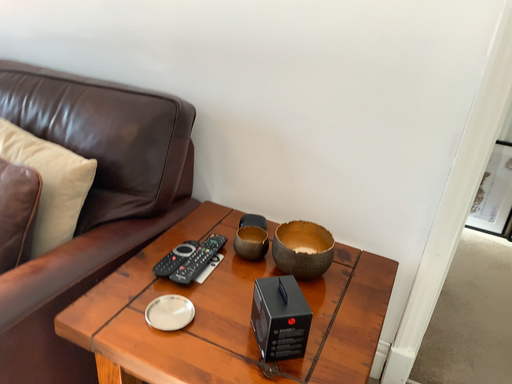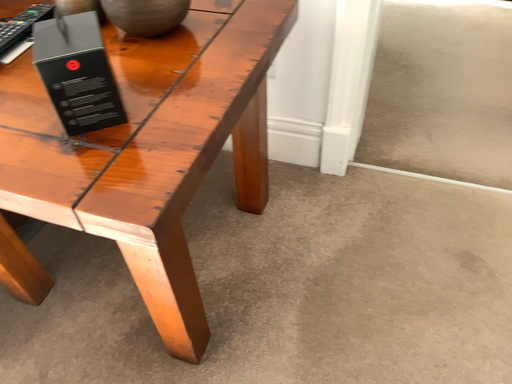
Question: Which way did the camera rotate in the video?

Choices:
 (A) rotated upward
 (B) rotated downward

Answer: (B)